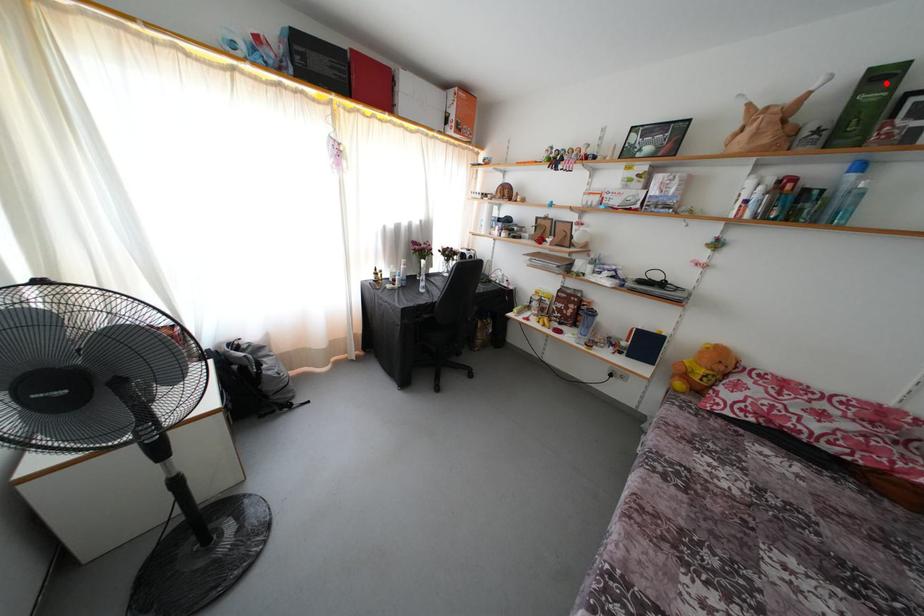
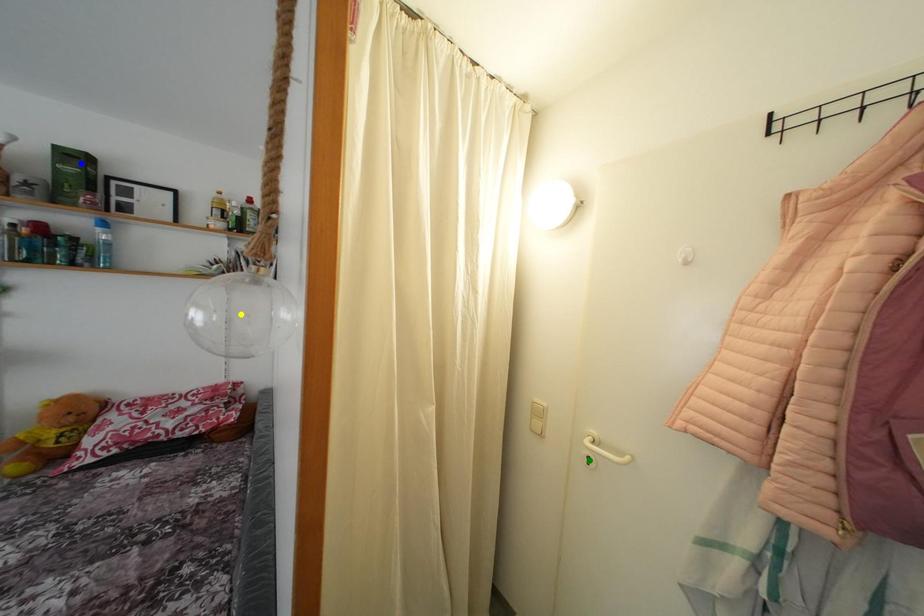
Question: I am providing you with two images of the same scene from different viewpoints. A red point is marked on the first image. You are given multiple points on the second image. Which spot in image 2 lines up with the point in image 1?

Choices:
 (A) yellow point
 (B) green point
 (C) blue point

Answer: (C)